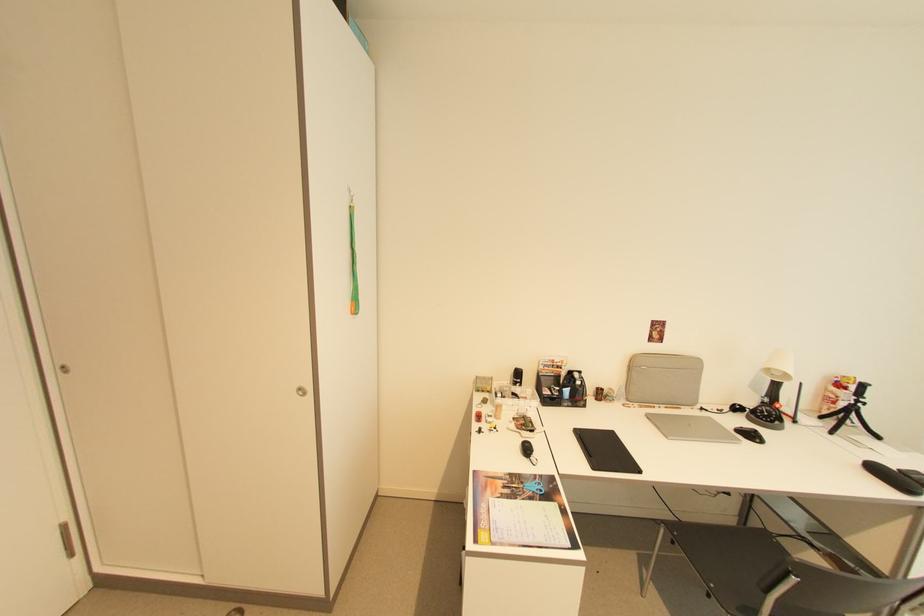
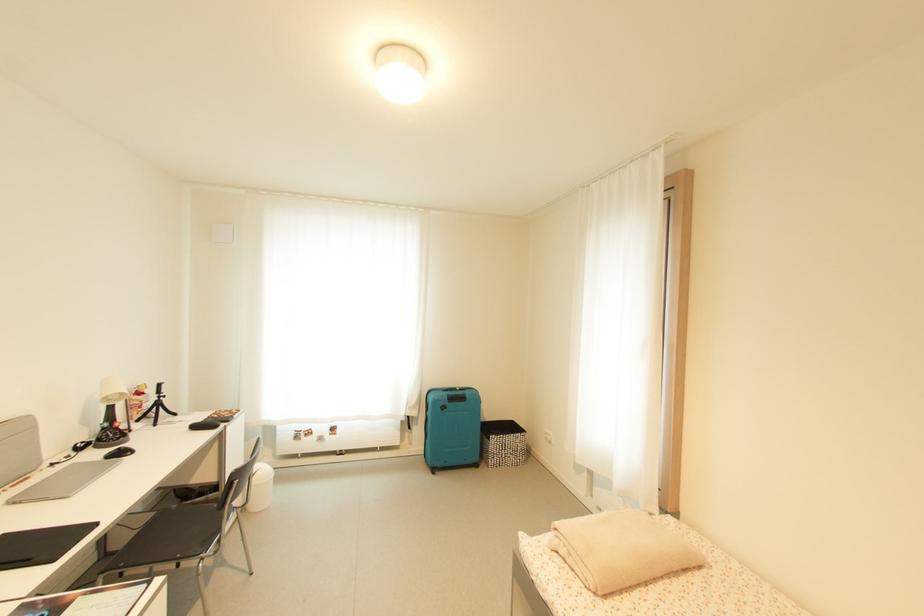
Question: The camera is either moving clockwise (left) or counter-clockwise (right) around the object. The first image is from the beginning of the video and the second image is from the end. Is the camera moving left or right when shooting the video?

Choices:
 (A) Left
 (B) Right

Answer: (A)